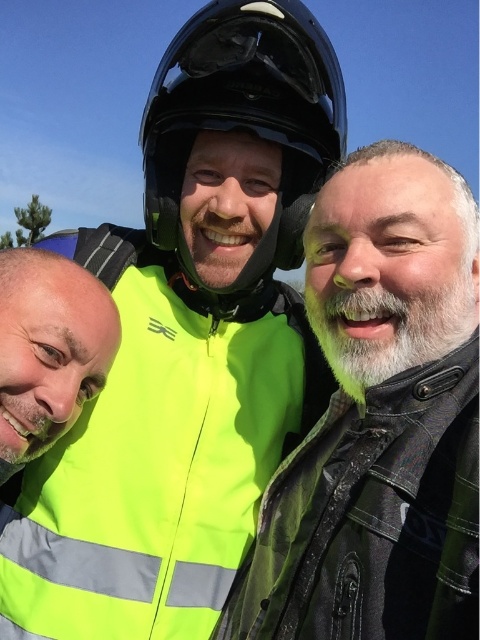
How distant is neon yellow jacket at center from glossy black helmet at center?

neon yellow jacket at center is 26.27 inches away from glossy black helmet at center.

Between neon yellow jacket at center and glossy black helmet at center, which one is positioned higher?

Positioned higher is glossy black helmet at center.

In the scene shown: Who is more forward, (x=399, y=150) or (x=319, y=129)?

Positioned in front is point (x=399, y=150).

Where is `neon yellow jacket at center`? neon yellow jacket at center is located at coordinates (380, 420).

Looking at this image, between neon yellow reflective vest at center and neon yellow vest at left, which one is positioned higher?

neon yellow reflective vest at center

Consider the image. Measure the distance between point (203,561) and camera.

The distance of point (203,561) from camera is 1.84 meters.

What are the coordinates of `neon yellow reflective vest at center` in the screenshot? It's located at (189, 340).

From the picture: Does glossy black helmet at center have a smaller size compared to neon yellow vest at left?

No, glossy black helmet at center is not smaller than neon yellow vest at left.

Measure the distance between point (x=267, y=44) and camera.

The distance of point (x=267, y=44) from camera is 5.91 feet.

The width and height of the screenshot is (480, 640). Identify the location of glossy black helmet at center. (245, 116).

Locate an element on the screen. This screenshot has height=640, width=480. glossy black helmet at center is located at coordinates (245, 116).